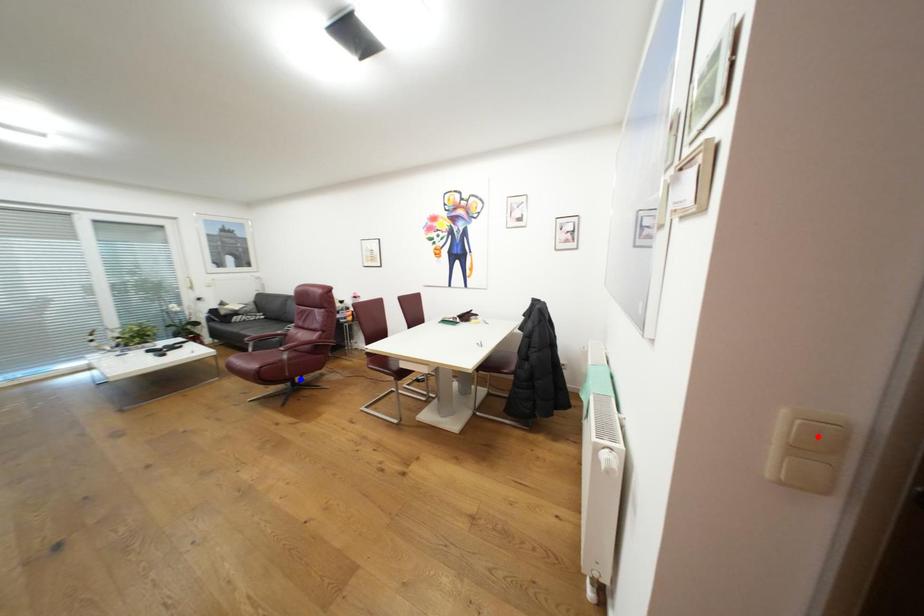
Question: In the image, two points are highlighted. Which point is nearer to the camera? Reply with the corresponding letter.

Choices:
 (A) blue point
 (B) red point

Answer: (B)